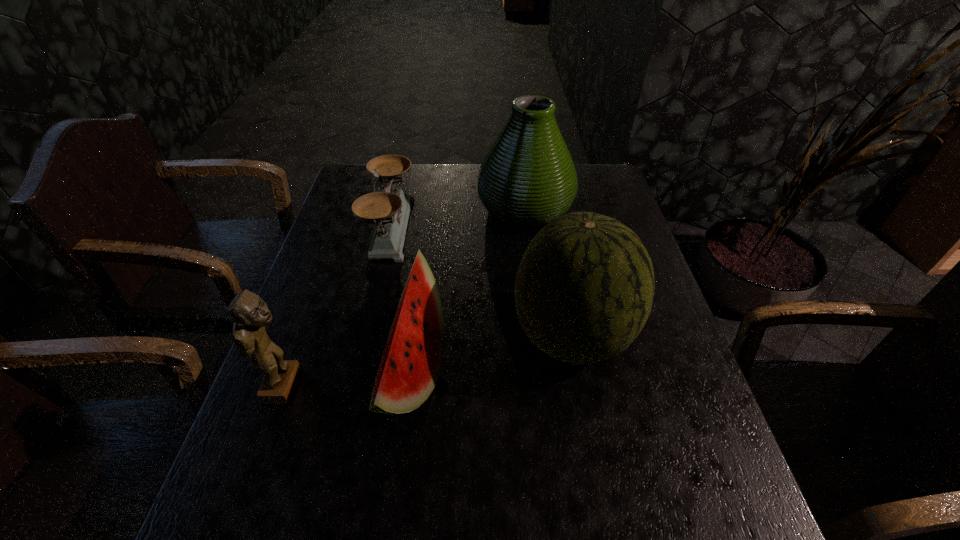
Where is `vase`? vase is located at coordinates click(527, 179).

At what (x,y) coordinates should I click in order to perform the action: click on the right watermelon. Please return your answer as a coordinate pair (x, y). Looking at the image, I should click on (584, 289).

Identify the location of the third shortest object. The width and height of the screenshot is (960, 540). (251, 315).

This screenshot has width=960, height=540. Identify the location of the leftmost object. (251, 315).

At what (x,y) coordinates should I click in order to perform the action: click on scale. Please return your answer as a coordinate pair (x, y). This screenshot has width=960, height=540. Looking at the image, I should click on (389, 210).

Find the location of a particular element. the left watermelon is located at coordinates (410, 366).

Locate an element on the screen. The width and height of the screenshot is (960, 540). free region located on the front of the vase is located at coordinates (537, 299).

The width and height of the screenshot is (960, 540). Identify the location of blank space located on the left of the taller watermelon. (435, 337).

Image resolution: width=960 pixels, height=540 pixels. Identify the location of free spot located on the front-facing side of the third tallest object. [396, 386].

In order to click on free spot located 0.330m on the front-facing side of the scale in this screenshot , I will do `click(521, 227)`.